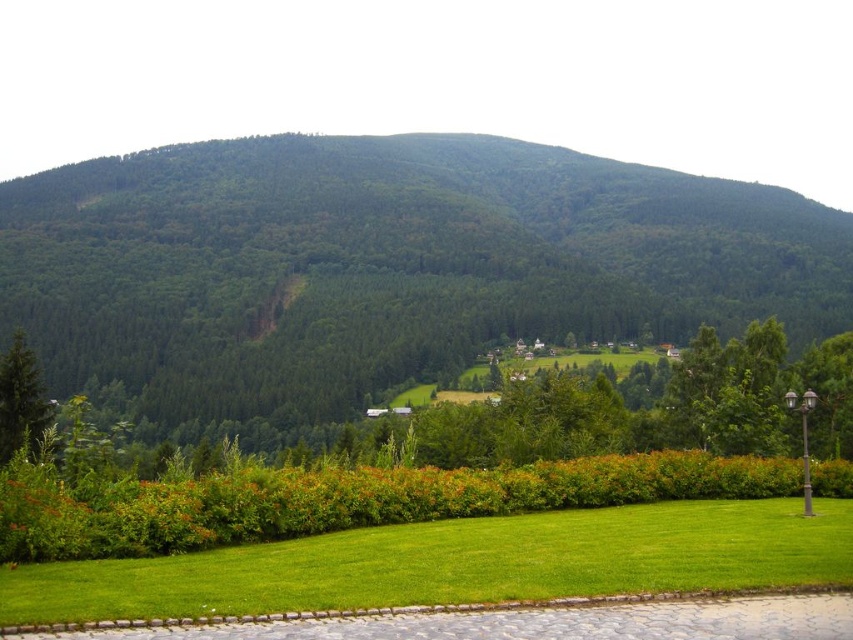
You are standing at the edge of the green lawn at center and want to walk towards the green matte tree at lower left. Which direction should you head to reach it?

To reach the green matte tree at lower left from the green lawn at center, you should head upwards since the green lawn at center is located below the green matte tree at lower left.

You are standing at the center of the grassy area and want to take a photo of the green forested mountain at upper center. Which direction should you face to ensure it is in the center of your view?

You should face towards the upper center direction to have the green forested mountain at upper center in the center of your view.

You are standing at the edge of the grassy area and want to take a photo of both the green forested mountain at upper center and the green matte tree at lower left. Which object will appear larger in your camera viewfinder?

The green forested mountain at upper center will appear larger in the camera viewfinder because it has a greater height compared to the green matte tree at lower left.